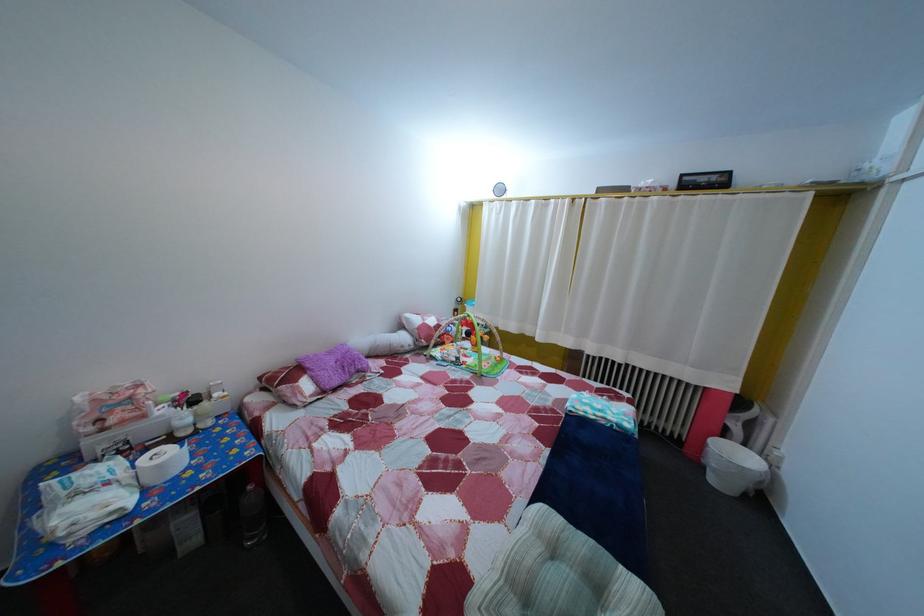
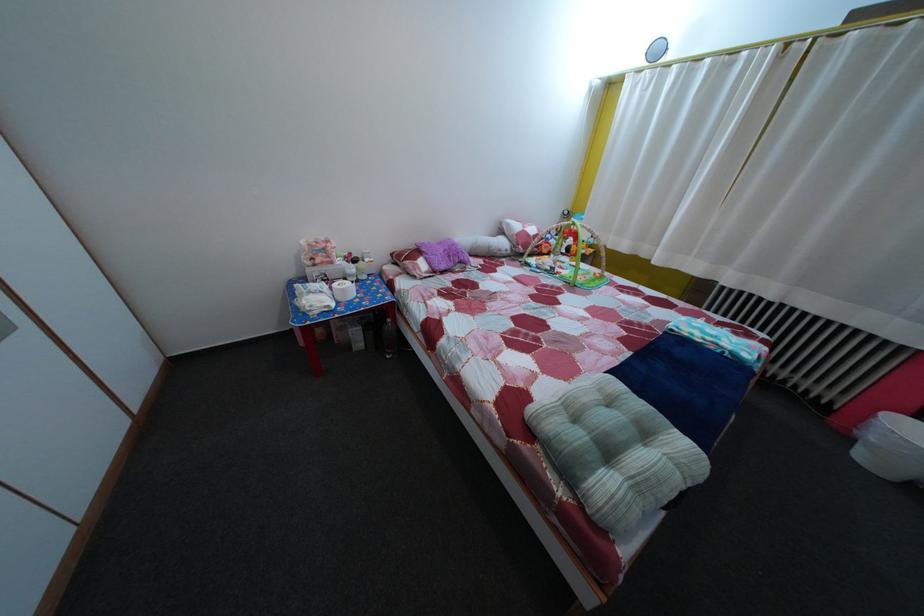
Locate, in the second image, the point that corresponds to point (530, 500) in the first image.

(601, 379)